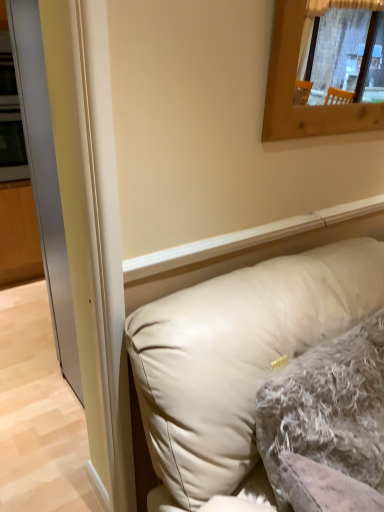
Question: From a real-world perspective, is beige leather pillow at lower right, positioned as the 1th pillow in front-to-back order, positioned above or below transparent glass door at left?

Choices:
 (A) below
 (B) above

Answer: (A)

Question: From the image's perspective, relative to transparent glass door at left, is beige leather pillow at lower right, the second pillow in the back-to-front sequence, above or below?

Choices:
 (A) above
 (B) below

Answer: (B)

Question: Based on their relative distances, which object is farther from the fuzzy gray pillow at center, the first pillow in the back-to-front sequence?

Choices:
 (A) beige leather pillow at lower right, the second pillow in the back-to-front sequence
 (B) transparent glass door at left

Answer: (B)

Question: Which is nearer to the fuzzy gray pillow at center, the first pillow in the back-to-front sequence?

Choices:
 (A) transparent glass door at left
 (B) beige leather pillow at lower right, the second pillow in the back-to-front sequence

Answer: (B)